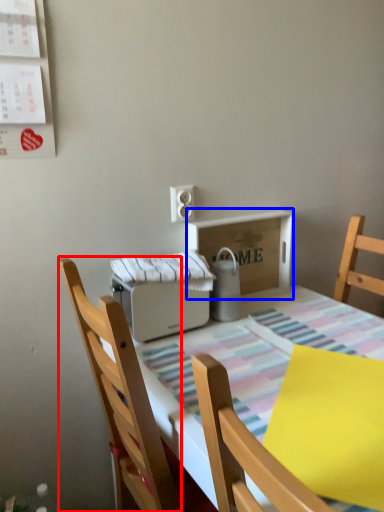
Question: Which of the following is the farthest to the observer, chair (highlighted by a red box) or cardboard box (highlighted by a blue box)?

Choices:
 (A) chair
 (B) cardboard box

Answer: (B)